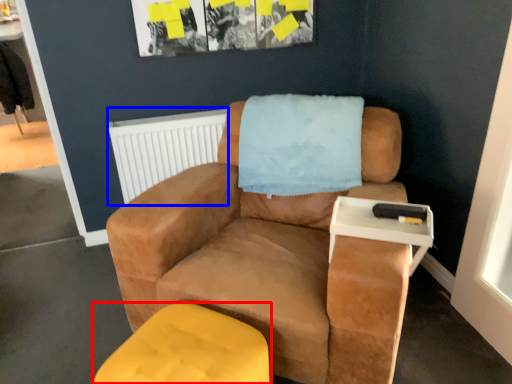
Question: Which of the following is the farthest to the observer, furniture (highlighted by a red box) or radiator (highlighted by a blue box)?

Choices:
 (A) furniture
 (B) radiator

Answer: (B)